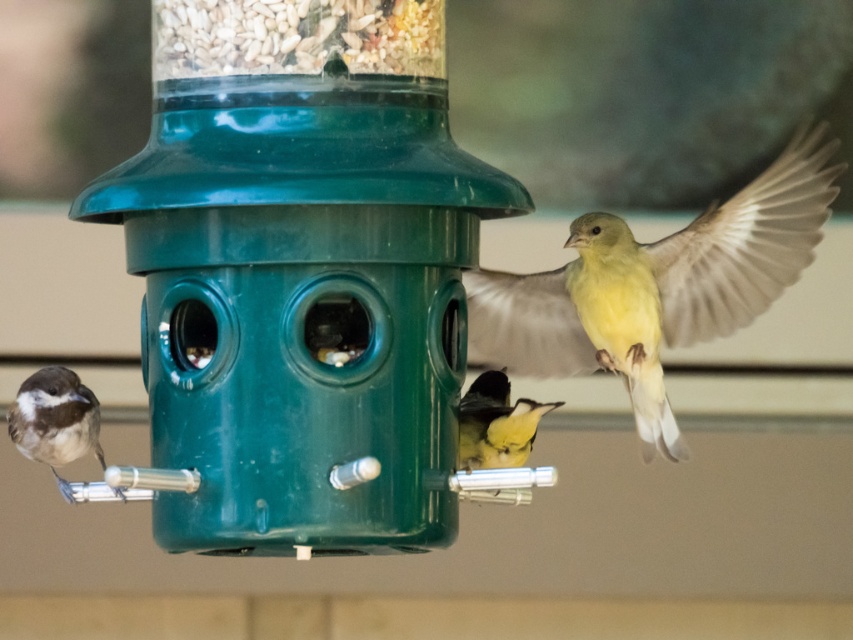
Question: Considering the real-world distances, which object is closest to the grainy seeds at top center?

Choices:
 (A) brown speckled feathers at left
 (B) green plastic bird feeder at center

Answer: (B)

Question: Can you confirm if grainy seeds at top center is positioned to the left of brown speckled feathers at left?

Choices:
 (A) no
 (B) yes

Answer: (A)

Question: Which point appears closest to the camera in this image?

Choices:
 (A) (517, 296)
 (B) (16, 449)
 (C) (131, 248)
 (D) (155, 16)

Answer: (C)

Question: Does green plastic bird feeder at center appear under brown speckled feathers at left?

Choices:
 (A) no
 (B) yes

Answer: (A)

Question: Does green plastic bird feeder at center have a lesser width compared to brown speckled feathers at left?

Choices:
 (A) no
 (B) yes

Answer: (A)

Question: Which is farther from the green plastic bird feeder at center?

Choices:
 (A) grainy seeds at top center
 (B) brown speckled feathers at left
 (C) yellow matte bird at upper right

Answer: (C)